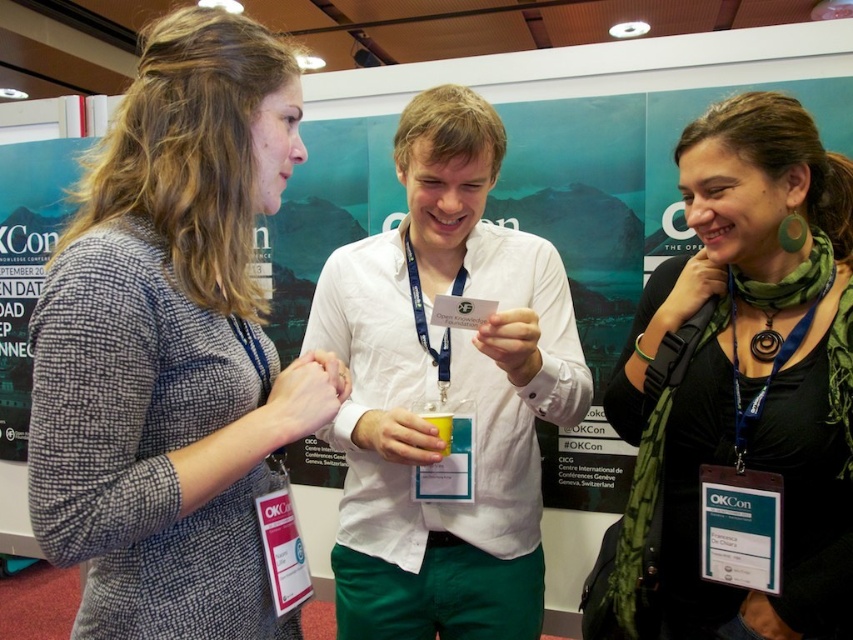
Is black matte scarf at center shorter than white cotton shirt at center?

Yes.

This screenshot has height=640, width=853. Identify the location of black matte scarf at center. (743, 392).

Does point (103, 403) come in front of point (717, 400)?

Yes.

Does gray woolen blazer at left appear on the right side of black matte scarf at center?

In fact, gray woolen blazer at left is to the left of black matte scarf at center.

Is point (148, 140) closer to camera compared to point (688, 356)?

Yes, point (148, 140) is closer to viewer.

Image resolution: width=853 pixels, height=640 pixels. What are the coordinates of `gray woolen blazer at left` in the screenshot? It's located at (172, 346).

Who is more distant from viewer, (811, 420) or (442, 440)?

The point (442, 440) is behind.

Which is above, black matte scarf at center or yellow plastic cup at center?

black matte scarf at center is above.

Is point (849, 333) positioned behind point (430, 420)?

No, (849, 333) is in front of (430, 420).

This screenshot has width=853, height=640. I want to click on black matte scarf at center, so click(x=743, y=392).